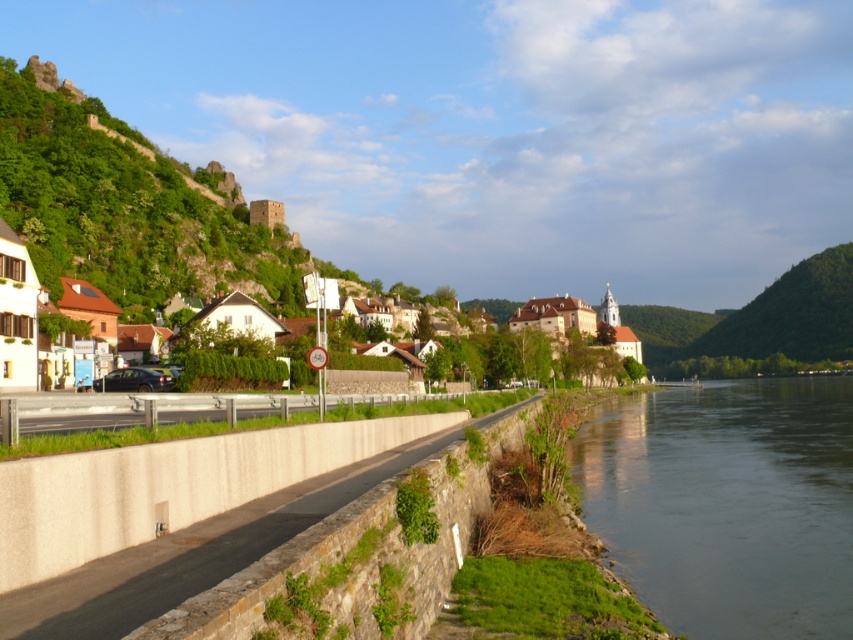
You are a tourist standing on the paved pathway and want to take a photo of the white matte houses at center and the green grassy riverbank at lower right. Which object should you focus on first if you want to capture both in a single frame without moving your camera?

You should focus on the white matte houses at center first because the green grassy riverbank at lower right is positioned under it, so adjusting the camera angle to include both would require framing from the top down.

You are a tourist standing on the paved pathway near the stone wall. You want to take a photo that includes both the green grassy riverbank at lower right and the white matte houses at center. Which object should you position closer to the front of your camera frame to ensure both are in focus?

To ensure both the green grassy riverbank at lower right and the white matte houses at center are in focus, position the green grassy riverbank at lower right closer to the front of your camera frame since it is nearer to you than the white matte houses at center.

You are standing at the center of the paved pathway and want to reach the green grassy riverbank at lower right. Which direction should you walk to get there?

You should walk towards the lower right direction to reach the green grassy riverbank at lower right as it is located at point (x=727, y=502).